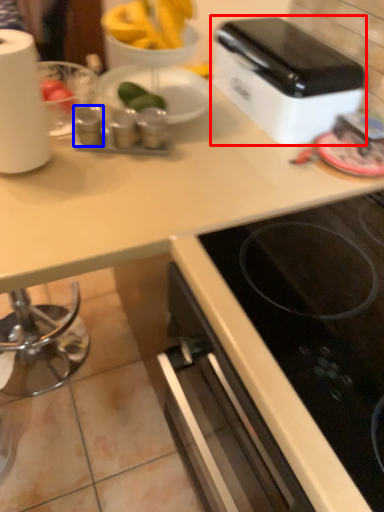
Question: Among these objects, which one is nearest to the camera, toaster (highlighted by a red box) or appliance (highlighted by a blue box)?

Choices:
 (A) toaster
 (B) appliance

Answer: (A)